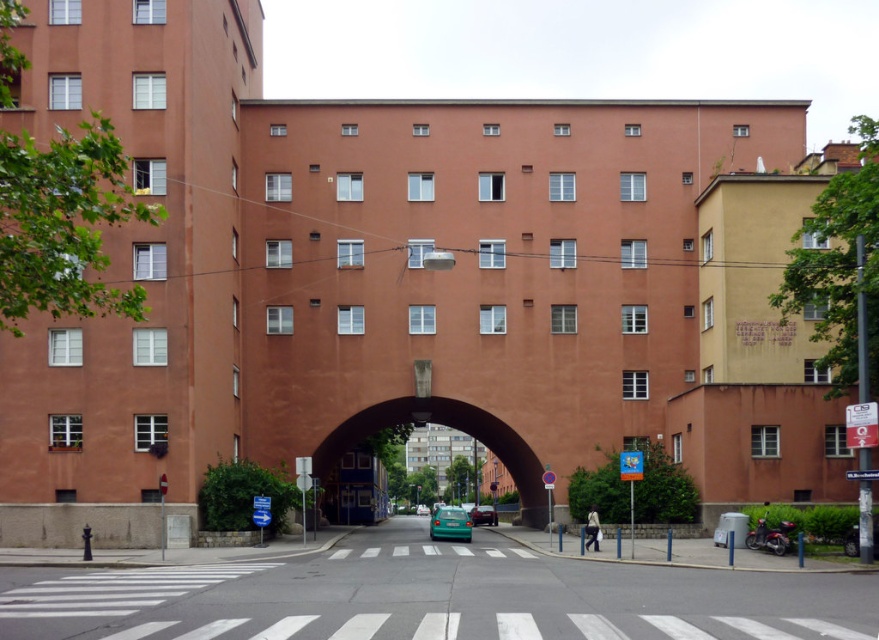
You are a pedestrian standing at the edge of the street and see the brown concrete archway at center and the green matte car at center. Which object is closer to you?

The brown concrete archway at center is closer to you because the green matte car at center is behind it.

You are a delivery driver who needs to park your teal matte car at center in a spot that is exactly at the center of the image. Based on the scene description, is the current position of your car correctly parked? Please explain using the coordinates provided.

The teal matte car at center is located at coordinates point (483, 515). Since the center of the image would be at coordinates (439, 320), the car is not parked correctly as its position is offset to the right and slightly above the true center.